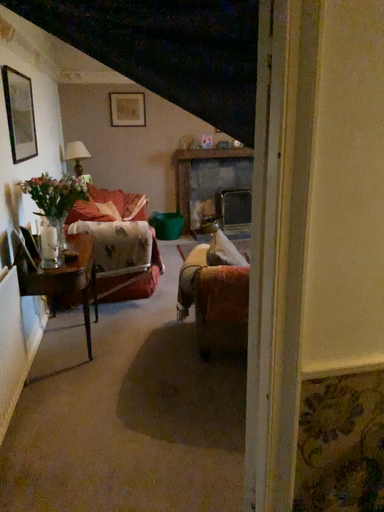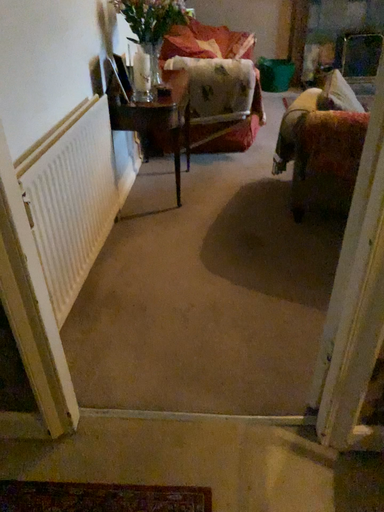
Question: How did the camera likely rotate when shooting the video?

Choices:
 (A) rotated downward
 (B) rotated upward

Answer: (A)